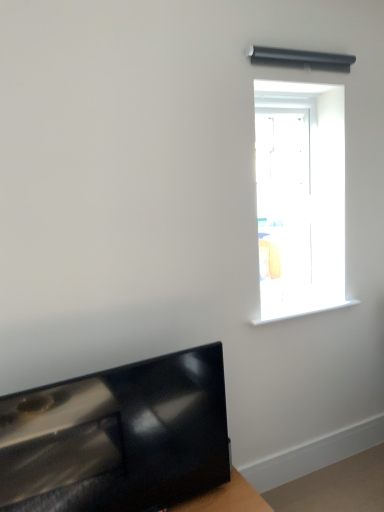
Describe the element at coordinates (300, 197) in the screenshot. I see `transparent glass door at upper right` at that location.

Where is `wooden table at lower right`? wooden table at lower right is located at coordinates (226, 498).

I want to click on transparent glass door at upper right, so click(x=300, y=197).

Is glossy black tv at lower left completely or partially outside of white plastic window sill at upper right?

glossy black tv at lower left is positioned outside white plastic window sill at upper right.

From a real-world perspective, which is physically below, glossy black tv at lower left or white plastic window sill at upper right?

In real-world perspective, glossy black tv at lower left is lower.

Can you confirm if glossy black tv at lower left is thinner than white plastic window sill at upper right?

Indeed, glossy black tv at lower left has a lesser width compared to white plastic window sill at upper right.

Based on the photo, are glossy black tv at lower left and white plastic window sill at upper right located far from each other?

No, there isn't a large distance between glossy black tv at lower left and white plastic window sill at upper right.

How far apart are glossy black tv at lower left and wooden table at lower right?

glossy black tv at lower left and wooden table at lower right are 13.62 inches apart from each other.

Is glossy black tv at lower left oriented away from wooden table at lower right?

No, wooden table at lower right is not at the back of glossy black tv at lower left.

The width and height of the screenshot is (384, 512). In order to click on table lying on the right of glossy black tv at lower left in this screenshot , I will do `click(226, 498)`.

Can you confirm if white plastic window sill at upper right is taller than glossy black tv at lower left?

No.

From the picture: Which of these two, white plastic window sill at upper right or glossy black tv at lower left, is thinner?

glossy black tv at lower left is thinner.

Can you confirm if white plastic window sill at upper right is positioned to the left of glossy black tv at lower left?

No, white plastic window sill at upper right is not to the left of glossy black tv at lower left.

Would you say white plastic window sill at upper right is a long distance from glossy black tv at lower left?

Actually, white plastic window sill at upper right and glossy black tv at lower left are a little close together.

From the image's perspective, would you say transparent glass door at upper right is positioned over white plastic window sill at upper right?

Correct, transparent glass door at upper right appears higher than white plastic window sill at upper right in the image.

Is transparent glass door at upper right to the left of white plastic window sill at upper right from the viewer's perspective?

Correct, you'll find transparent glass door at upper right to the left of white plastic window sill at upper right.

Is point (279, 207) closer or farther from the camera than point (301, 306)?

Point (279, 207) appears to be closer to the viewer than point (301, 306).

You are a GUI agent. You are given a task and a screenshot of the screen. Output one action in this format:
    pyautogui.click(x=<x>, y=<y>)
    Task: Click on the window positioned vertically above the white plastic window sill at upper right (from a real-world perspective)
    The image size is (384, 512).
    Given the screenshot: What is the action you would take?
    pyautogui.click(x=300, y=197)

Would you say wooden table at lower right is part of transparent glass door at upper right's contents?

No, transparent glass door at upper right does not contain wooden table at lower right.

Who is smaller, transparent glass door at upper right or wooden table at lower right?

wooden table at lower right is smaller.

Looking at this image, is transparent glass door at upper right positioned before wooden table at lower right?

No, transparent glass door at upper right is further to the viewer.

Based on the photo, are transparent glass door at upper right and wooden table at lower right making contact?

transparent glass door at upper right is not next to wooden table at lower right, and they're not touching.

Can you confirm if wooden table at lower right is wider than white plastic window sill at upper right?

Yes, wooden table at lower right is wider than white plastic window sill at upper right.

Is white plastic window sill at upper right at the back of wooden table at lower right?

That's not correct — wooden table at lower right is not looking away from white plastic window sill at upper right.

From the image's perspective, which one is positioned lower, wooden table at lower right or white plastic window sill at upper right?

wooden table at lower right is shown below in the image.

Considering the sizes of objects wooden table at lower right and white plastic window sill at upper right in the image provided, who is bigger, wooden table at lower right or white plastic window sill at upper right?

Bigger between the two is wooden table at lower right.

Between glossy black tv at lower left and transparent glass door at upper right, which one has more height?

With more height is transparent glass door at upper right.

Is glossy black tv at lower left smaller than transparent glass door at upper right?

Yes.

From a real-world perspective, is glossy black tv at lower left on top of transparent glass door at upper right?

Actually, glossy black tv at lower left is physically below transparent glass door at upper right in the real world.

You are a GUI agent. You are given a task and a screenshot of the screen. Output one action in this format:
    pyautogui.click(x=<x>, y=<y>)
    Task: Click on the furniture below the white plastic window sill at upper right (from a real-world perspective)
    This screenshot has height=512, width=384.
    Given the screenshot: What is the action you would take?
    pyautogui.click(x=117, y=437)

You are a GUI agent. You are given a task and a screenshot of the screen. Output one action in this format:
    pyautogui.click(x=<x>, y=<y>)
    Task: Click on the table that is below the glossy black tv at lower left (from the image's perspective)
    This screenshot has height=512, width=384.
    Given the screenshot: What is the action you would take?
    pyautogui.click(x=226, y=498)

Estimate the real-world distances between objects in this image. Which object is further from glossy black tv at lower left, transparent glass door at upper right or wooden table at lower right?

transparent glass door at upper right lies further to glossy black tv at lower left than the other object.

Considering their positions, is white plastic window sill at upper right positioned closer to glossy black tv at lower left than transparent glass door at upper right?

The object closer to glossy black tv at lower left is white plastic window sill at upper right.

Estimate the real-world distances between objects in this image. Which object is further from transparent glass door at upper right, wooden table at lower right or white plastic window sill at upper right?

Among the two, wooden table at lower right is located further to transparent glass door at upper right.

When comparing their distances from transparent glass door at upper right, does glossy black tv at lower left or white plastic window sill at upper right seem closer?

Among the two, white plastic window sill at upper right is located nearer to transparent glass door at upper right.

Based on their spatial positions, is glossy black tv at lower left or white plastic window sill at upper right further from wooden table at lower right?

white plastic window sill at upper right.

Looking at the image, which one is located further to glossy black tv at lower left, wooden table at lower right or white plastic window sill at upper right?

white plastic window sill at upper right lies further to glossy black tv at lower left than the other object.

When comparing their distances from wooden table at lower right, does white plastic window sill at upper right or transparent glass door at upper right seem closer?

white plastic window sill at upper right.

Estimate the real-world distances between objects in this image. Which object is further from white plastic window sill at upper right, glossy black tv at lower left or wooden table at lower right?

wooden table at lower right lies further to white plastic window sill at upper right than the other object.

Identify the location of furniture between white plastic window sill at upper right and wooden table at lower right vertically. Image resolution: width=384 pixels, height=512 pixels. (117, 437).

Where is `window sill between transparent glass door at upper right and wooden table at lower right in the up-down direction`? window sill between transparent glass door at upper right and wooden table at lower right in the up-down direction is located at coordinates (301, 309).

Image resolution: width=384 pixels, height=512 pixels. I want to click on furniture that lies between transparent glass door at upper right and wooden table at lower right from top to bottom, so click(117, 437).

The image size is (384, 512). Identify the location of window sill that lies between transparent glass door at upper right and glossy black tv at lower left from top to bottom. (301, 309).